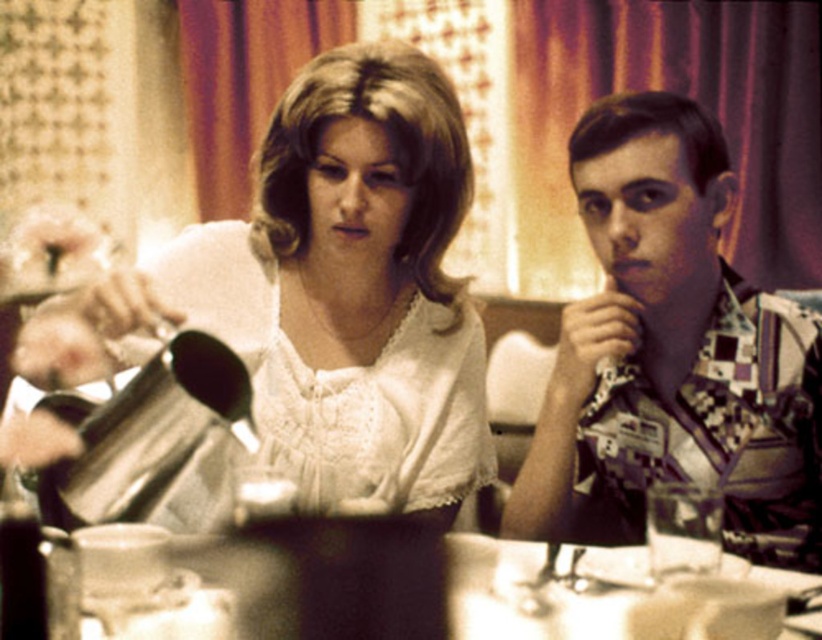
Question: Which point appears closest to the camera in this image?

Choices:
 (A) (234, 605)
 (B) (333, 131)
 (C) (575, 419)

Answer: (A)

Question: Is the position of white lace blouse at center more distant than that of metallic silver tray at center?

Choices:
 (A) no
 (B) yes

Answer: (B)

Question: Which object is the farthest from the white lace blouse at center?

Choices:
 (A) metallic silver tray at center
 (B) printed cotton shirt at right

Answer: (B)

Question: Can you confirm if white lace blouse at center is positioned below metallic silver tray at center?

Choices:
 (A) yes
 (B) no

Answer: (B)

Question: Which of the following is the closest to the observer?

Choices:
 (A) (316, 168)
 (B) (283, 598)

Answer: (B)

Question: Does white lace blouse at center come in front of printed cotton shirt at right?

Choices:
 (A) yes
 (B) no

Answer: (A)